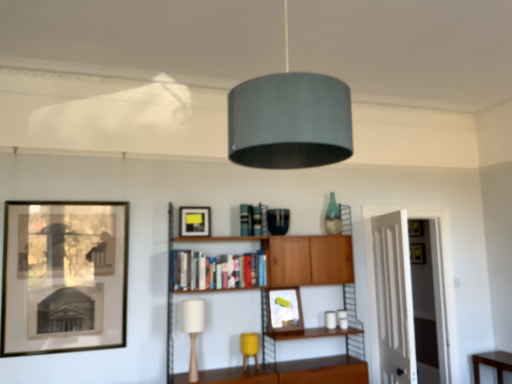
Question: Does point (244, 337) appear closer or farther from the camera than point (54, 238)?

Choices:
 (A) closer
 (B) farther

Answer: (B)

Question: Considering the positions of yellow fabric table lamp at lower center, the 1th table lamp viewed from the back, and matte black picture frame at left, which is the 1th picture frame from left to right, in the image, is yellow fabric table lamp at lower center, the 1th table lamp viewed from the back, bigger or smaller than matte black picture frame at left, which is the 1th picture frame from left to right,?

Choices:
 (A) small
 (B) big

Answer: (A)

Question: Which object is the closest to the yellow fabric table lamp at lower center, the 1th table lamp from the right?

Choices:
 (A) brown wooden table at lower right
 (B) matte black picture frame at upper center, which is the 2th picture frame in back-to-front order
 (C) white wood door at right
 (D) matte black picture frame at left, which is the 1th picture frame from left to right
 (E) white matte table lamp at center, marked as the first table lamp in a front-to-back arrangement

Answer: (E)

Question: Which object is positioned farthest from the matte black picture frame at upper center, which ranks as the second picture frame in front-to-back order?

Choices:
 (A) brown wooden table at lower right
 (B) white wood door at right
 (C) hardcover books at center
 (D) wooden cabinet at center
 (E) matte silver picture frame at center, positioned as the 1th picture frame in right-to-left order

Answer: (A)